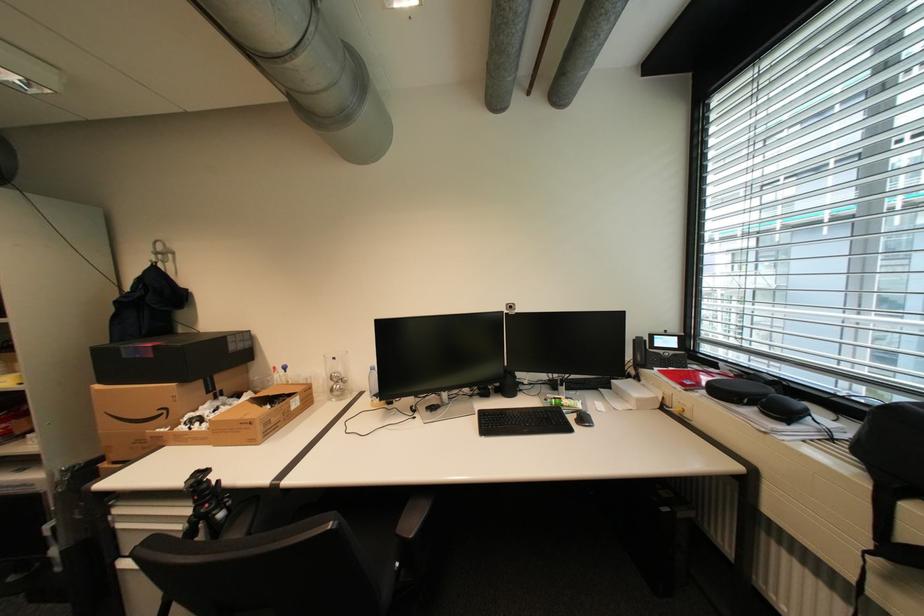
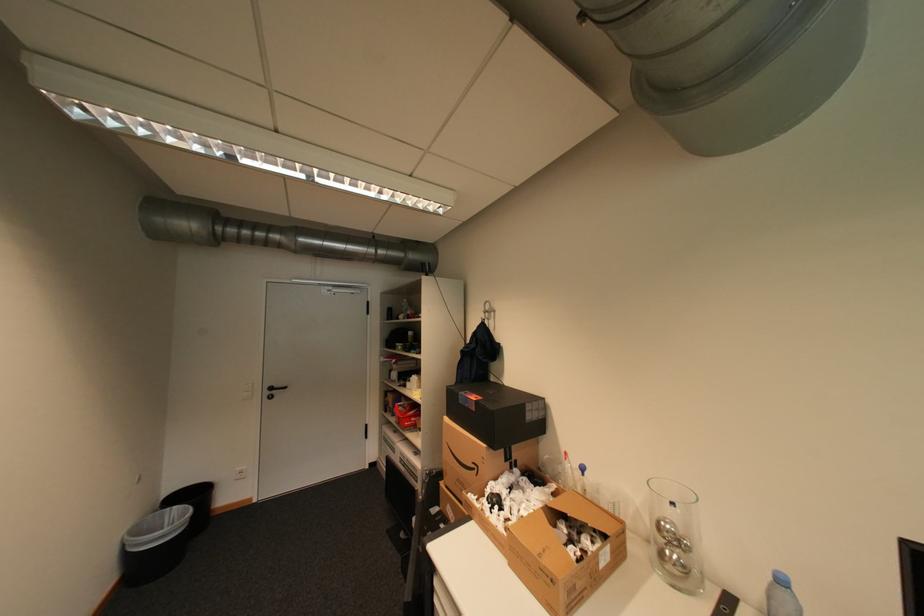
Locate, in the second image, the point that corresponds to point (343, 376) in the first image.

(673, 527)